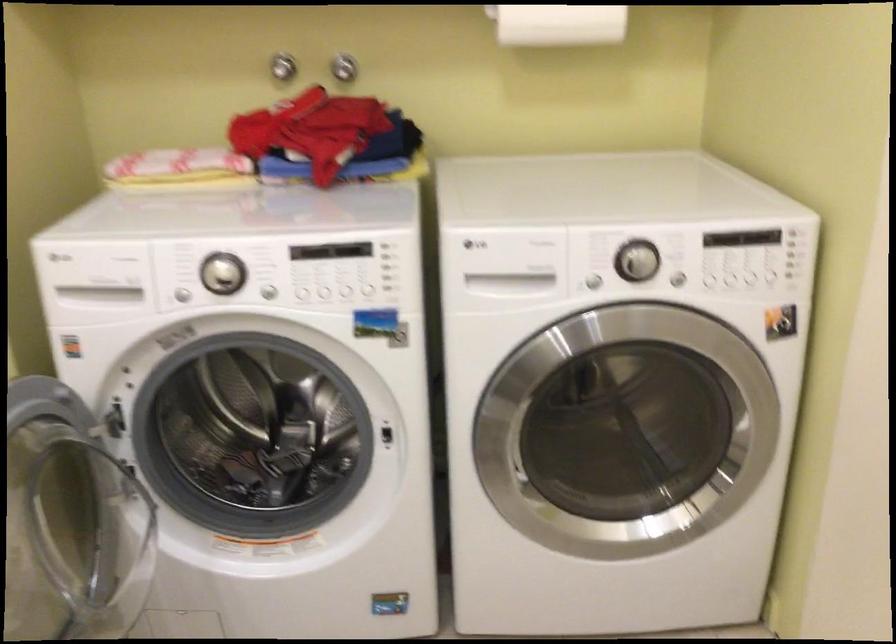
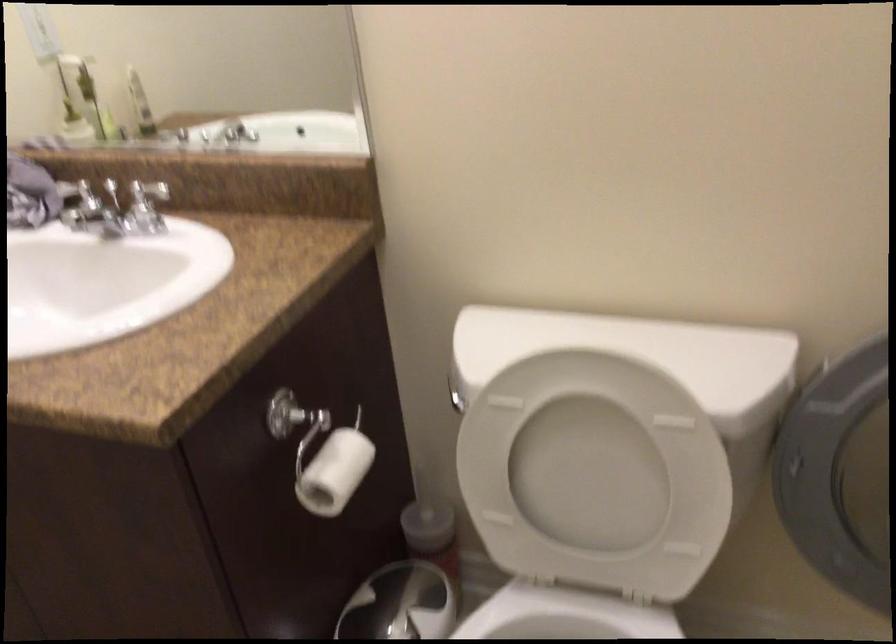
The images are taken continuously from a first-person perspective. In which direction is your viewpoint rotating?

The camera rotated toward left-down.